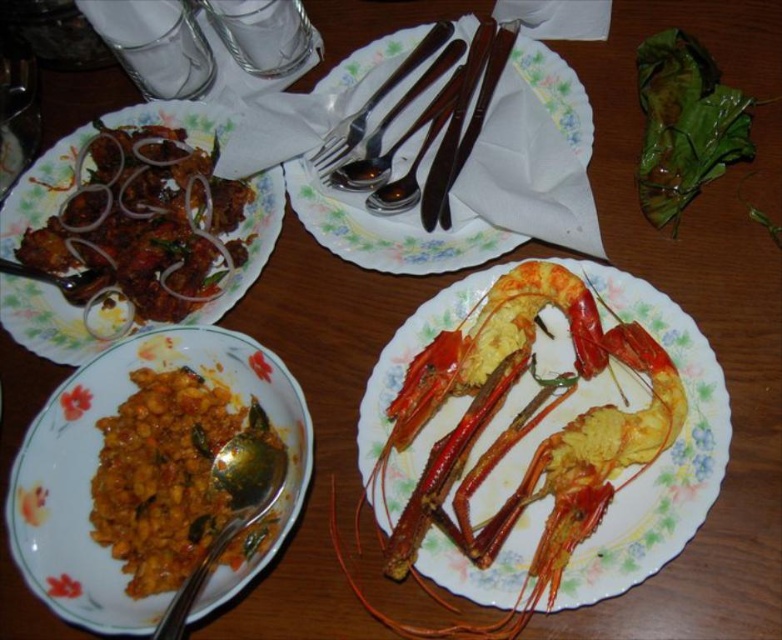
Between matte brown meat at left and metallic silverware at center, which one has more height?

With more height is metallic silverware at center.

Can you confirm if matte brown meat at left is positioned to the right of metallic silverware at center?

In fact, matte brown meat at left is to the left of metallic silverware at center.

Does point (106, 147) come in front of point (311, 196)?

No.

The width and height of the screenshot is (782, 640). What are the coordinates of `matte brown meat at left` in the screenshot? It's located at (142, 224).

Based on the photo, does matte brown meat at left come in front of satin silver fork at upper center?

Yes, matte brown meat at left is closer to the viewer.

Can you confirm if matte brown meat at left is shorter than satin silver fork at upper center?

In fact, matte brown meat at left may be taller than satin silver fork at upper center.

Identify the location of matte brown meat at left. (142, 224).

Locate an element on the screen. matte brown meat at left is located at coordinates (142, 224).

Can you confirm if golden fried prawns at center is shorter than spoon at lower left?

In fact, golden fried prawns at center may be taller than spoon at lower left.

Between golden fried prawns at center and spoon at lower left, which one has less height?

Standing shorter between the two is spoon at lower left.

The height and width of the screenshot is (640, 782). What do you see at coordinates (659, 456) in the screenshot? I see `golden fried prawns at center` at bounding box center [659, 456].

Find the location of a particular element. golden fried prawns at center is located at coordinates (659, 456).